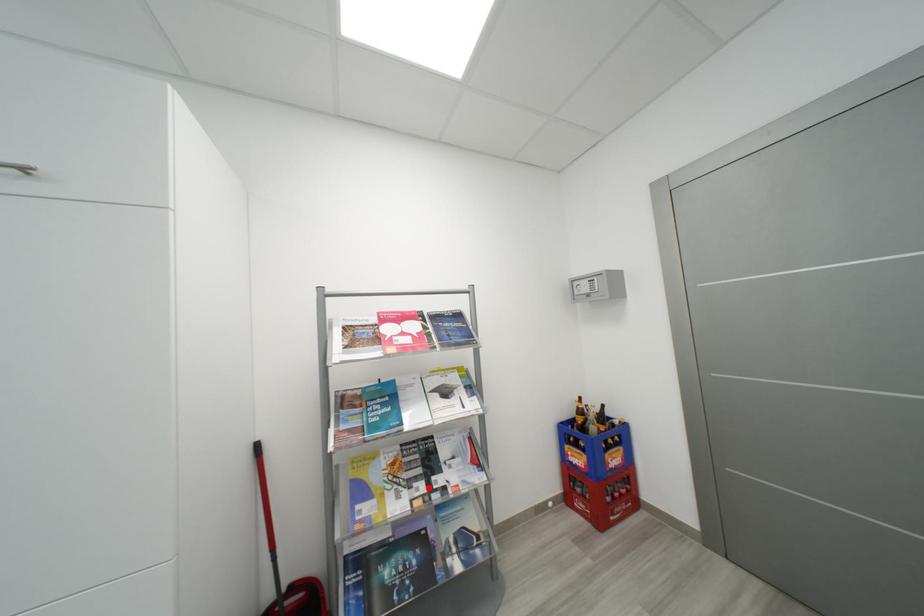
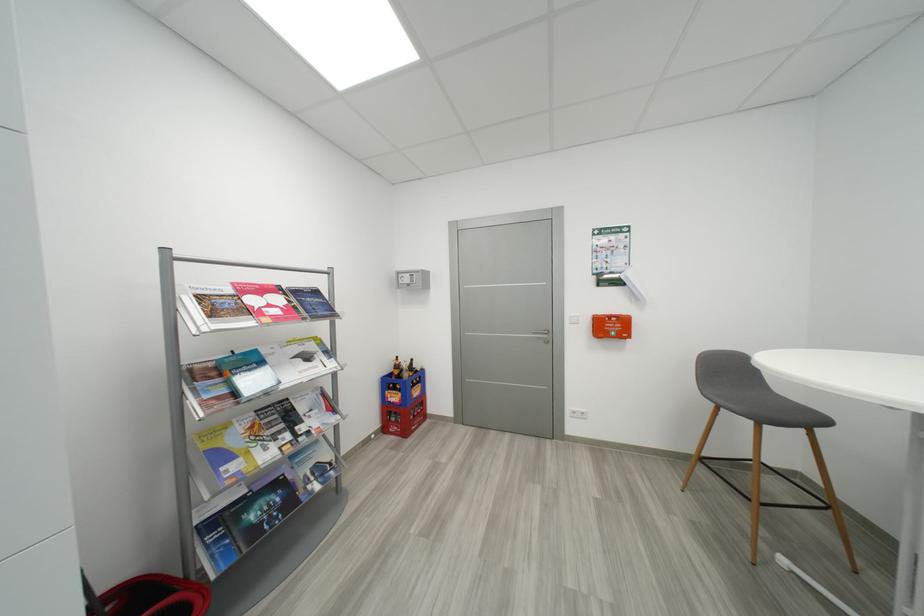
Locate, in the second image, the point that corresponds to the highlighted location in the first image.

(294, 438)